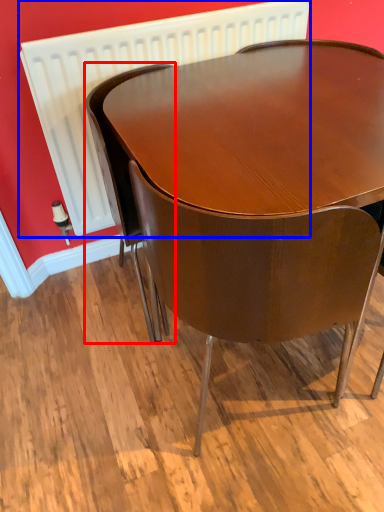
Question: Among these objects, which one is nearest to the camera, chair (highlighted by a red box) or radiator (highlighted by a blue box)?

Choices:
 (A) chair
 (B) radiator

Answer: (A)